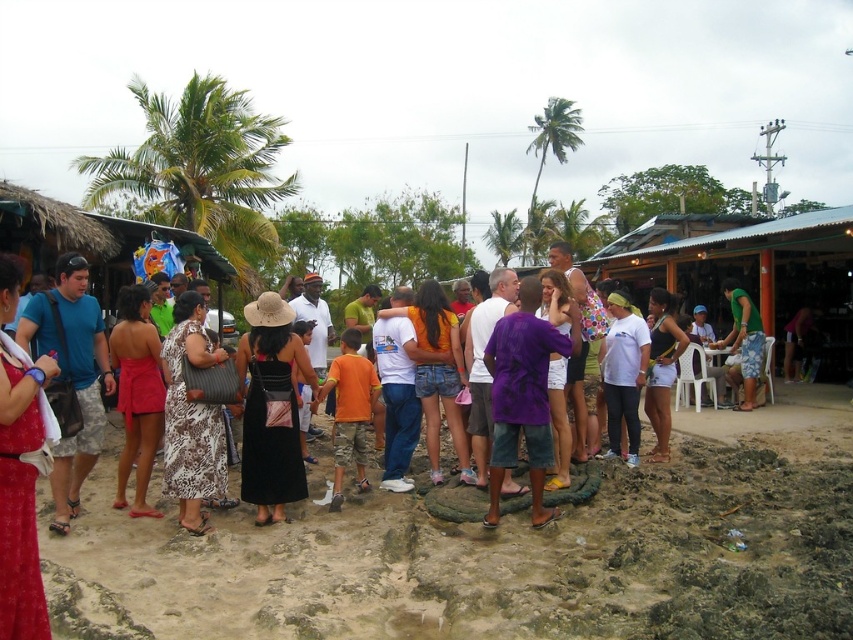
Question: Which of the following is the closest to the observer?

Choices:
 (A) (204, 518)
 (B) (53, 472)
 (C) (746, 298)
 (D) (534, 140)

Answer: (B)

Question: Can you confirm if pink fabric dress at left is positioned above green leafy palm tree at upper center?

Choices:
 (A) no
 (B) yes

Answer: (A)

Question: Which object is closer to the camera taking this photo?

Choices:
 (A) green leafy palm tree at center
 (B) green leafy palm tree at upper center

Answer: (B)

Question: Is brown sandy mud at center positioned before purple cotton shirt at center?

Choices:
 (A) yes
 (B) no

Answer: (A)

Question: Which point is closer to the camera?

Choices:
 (A) (194, 429)
 (B) (541, 161)
 (C) (561, 349)

Answer: (C)

Question: Can you confirm if green leafy palm tree at upper left is smaller than green leafy palm tree at center?

Choices:
 (A) yes
 (B) no

Answer: (B)